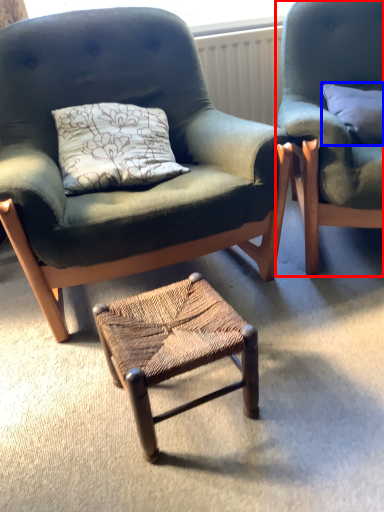
Question: Which object appears farthest to the camera in this image, chair (highlighted by a red box) or pillow (highlighted by a blue box)?

Choices:
 (A) chair
 (B) pillow

Answer: (B)